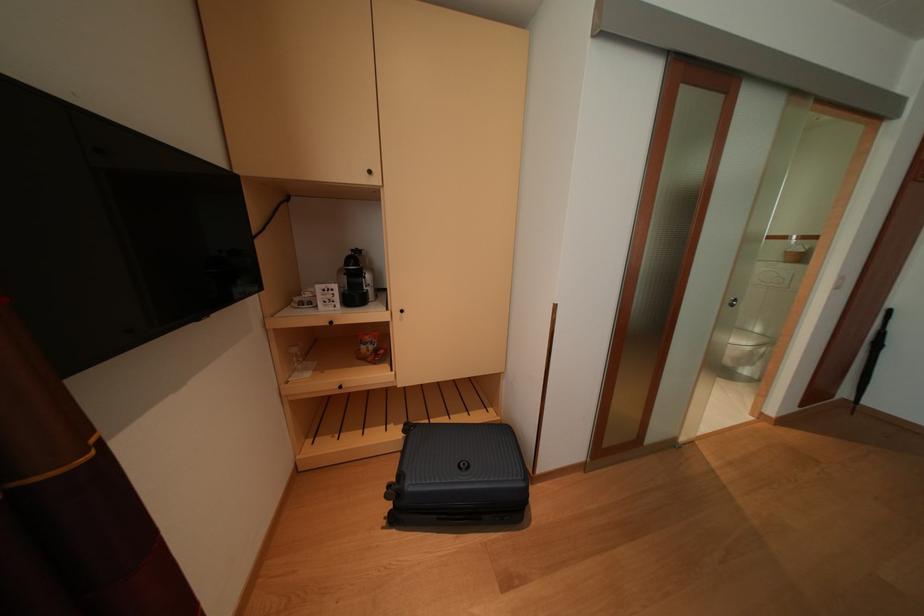
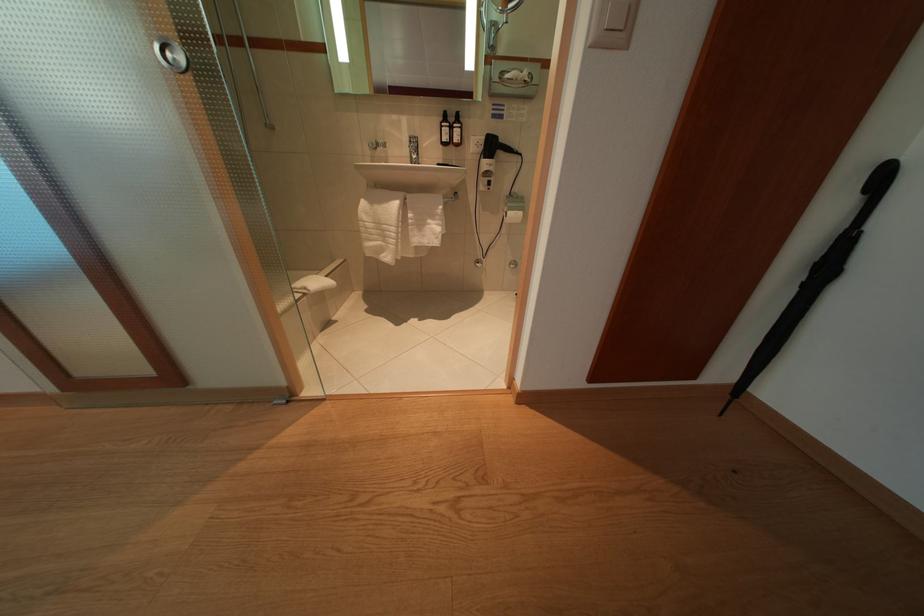
Which direction would the cameraman need to move to produce the second image?

The cameraman walked toward right, forward.